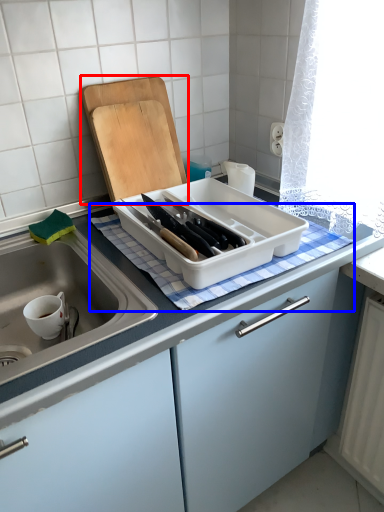
Question: Which object is closer to the camera taking this photo, cutting board (highlighted by a red box) or tablecloth (highlighted by a blue box)?

Choices:
 (A) cutting board
 (B) tablecloth

Answer: (B)